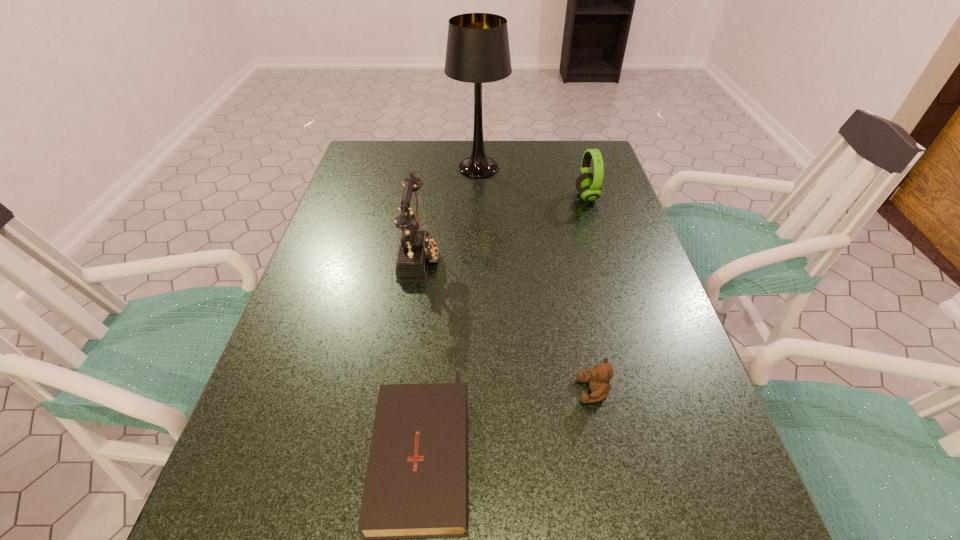
Where is `empty location between the tallest object and the headset`? The height and width of the screenshot is (540, 960). empty location between the tallest object and the headset is located at coordinates (533, 182).

Where is `free space between the tallest object and the telephone`? The height and width of the screenshot is (540, 960). free space between the tallest object and the telephone is located at coordinates (449, 212).

Find the location of a particular element. empty space that is in between the second shortest object and the third shortest object is located at coordinates (590, 294).

Identify the location of vacant space that is in between the headset and the teddy bear. (590, 294).

The image size is (960, 540). What are the coordinates of `vacant area between the farthest object and the third nearest object` in the screenshot? It's located at (449, 212).

The height and width of the screenshot is (540, 960). In order to click on object that is the closest to the second tallest object in this screenshot , I will do `click(477, 51)`.

Choose which object is the third nearest neighbor to the third shortest object. Please provide its 2D coordinates. Your answer should be formatted as a tuple, i.e. [(x, y)], where the tuple contains the x and y coordinates of a point satisfying the conditions above.

[(598, 379)]